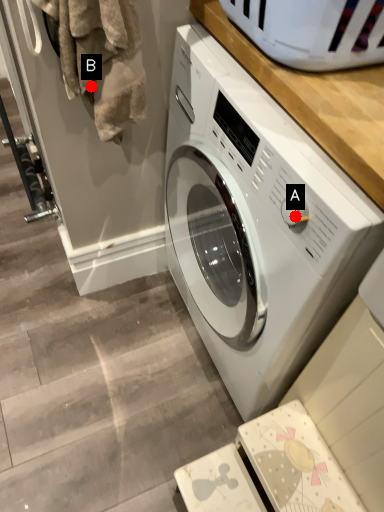
Question: Two points are circled on the image, labeled by A and B beside each circle. Among these points, which one is nearest to the camera?

Choices:
 (A) A is closer
 (B) B is closer

Answer: (A)